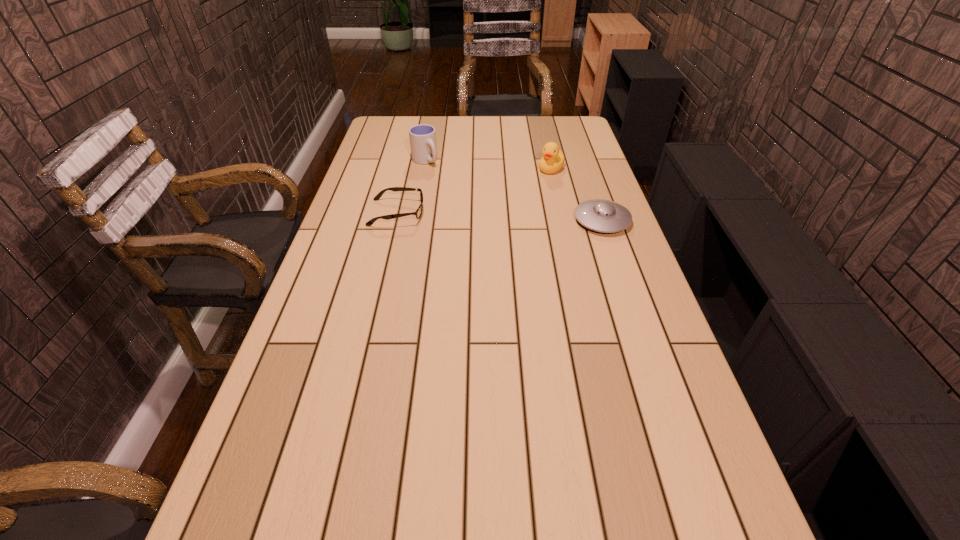
Find the location of a particular element. The image size is (960, 540). vacant space at the far right corner of the desktop is located at coordinates (549, 124).

The image size is (960, 540). Find the location of `vacant region at the near right corner of the desktop`. vacant region at the near right corner of the desktop is located at coordinates (726, 480).

Identify the location of empty space between the duckling and the saucer. (577, 194).

You are a GUI agent. You are given a task and a screenshot of the screen. Output one action in this format:
    pyautogui.click(x=<x>, y=<y>)
    Task: Click on the empty space between the saucer and the cup
    This screenshot has width=960, height=540.
    Given the screenshot: What is the action you would take?
    pyautogui.click(x=514, y=190)

The width and height of the screenshot is (960, 540). I want to click on unoccupied position between the cup and the duckling, so click(488, 165).

What are the coordinates of `unoccupied position between the spectacles and the cup` in the screenshot? It's located at (411, 187).

This screenshot has height=540, width=960. Identify the location of vacant space in between the saucer and the shortest object. (499, 217).

What are the coordinates of `free spot between the duckling and the shortest object` in the screenshot? It's located at (474, 191).

The width and height of the screenshot is (960, 540). I want to click on free spot between the saucer and the spectacles, so click(499, 217).

You are a GUI agent. You are given a task and a screenshot of the screen. Output one action in this format:
    pyautogui.click(x=<x>, y=<y>)
    Task: Click on the vacant area between the duckling and the saucer
    This screenshot has height=540, width=960.
    Given the screenshot: What is the action you would take?
    pyautogui.click(x=577, y=194)